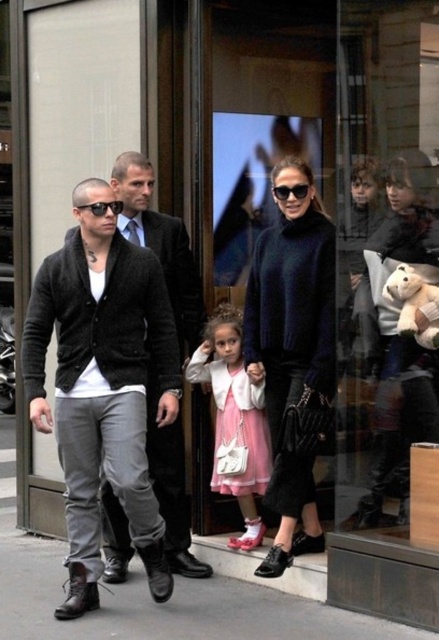
Question: Considering the relative positions of dark gray cardigan at left and dark blue sweater at center in the image provided, where is dark gray cardigan at left located with respect to dark blue sweater at center?

Choices:
 (A) left
 (B) right

Answer: (A)

Question: Which point is farther to the camera?

Choices:
 (A) (285, 196)
 (B) (227, 378)
 (C) (420, 307)

Answer: (B)

Question: Which of these objects is positioned farthest from the gray asphalt at lower center?

Choices:
 (A) dark gray knit sweater at center
 (B) black plastic sunglasses at center

Answer: (B)

Question: Where is dark gray cardigan at left located in relation to white plush teddy bear at center in the image?

Choices:
 (A) below
 (B) above

Answer: (A)

Question: Where is pink satin dress at center located in relation to black plastic sunglasses at center in the image?

Choices:
 (A) left
 (B) right

Answer: (A)

Question: Which is nearer to the dark gray knit sweater at center?

Choices:
 (A) gray asphalt at lower center
 (B) dark blue sweater at center

Answer: (B)